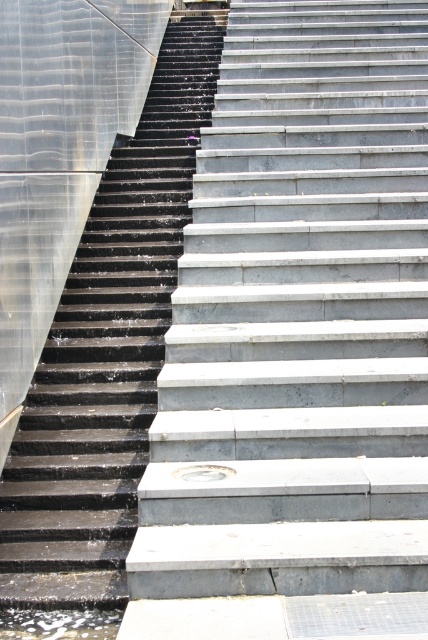
Who is more distant from viewer, (419, 80) or (101, 467)?

The point (419, 80) is behind.

Which is more to the left, smooth concrete stairs at center or black rubber stairs at left?

From the viewer's perspective, black rubber stairs at left appears more on the left side.

Who is more forward, (181, 275) or (151, 227)?

Point (181, 275)

Where is `smooth concrete stairs at center`? The width and height of the screenshot is (428, 640). smooth concrete stairs at center is located at coordinates (299, 317).